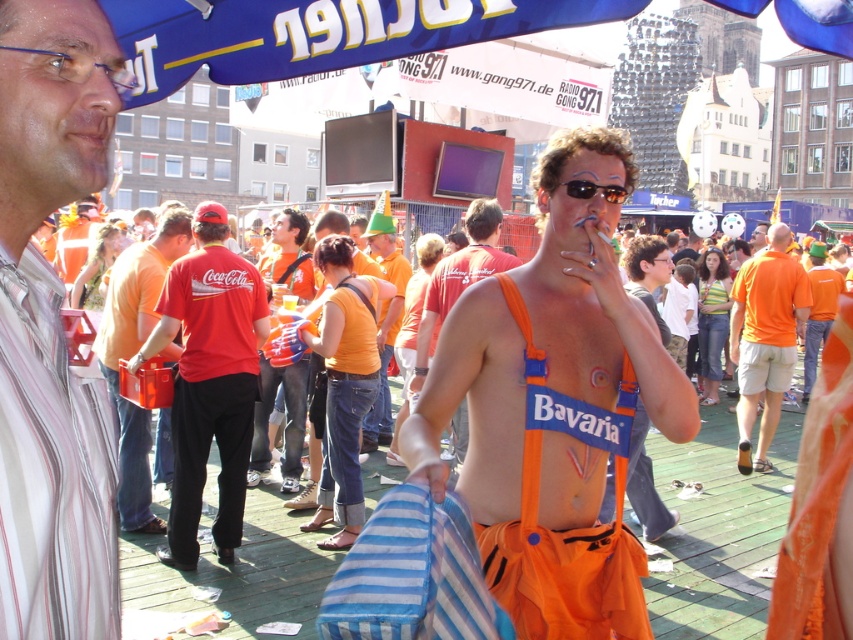
Which is behind, point (567, 228) or point (114, 97)?

Point (567, 228)

You are a GUI agent. You are given a task and a screenshot of the screen. Output one action in this format:
    pyautogui.click(x=<x>, y=<y>)
    Task: Click on the orange fabric at center
    Image resolution: width=853 pixels, height=640 pixels.
    Given the screenshot: What is the action you would take?
    pyautogui.click(x=555, y=404)

Is striped shirt at left positioned behind matte red t-shirt at center?

No, it is in front of matte red t-shirt at center.

Does point (21, 186) lie behind point (148, 330)?

No, it is in front of (148, 330).

Does point (22, 170) come farther from viewer compared to point (167, 212)?

That is False.

Locate an element on the screen. This screenshot has height=640, width=853. striped shirt at left is located at coordinates (51, 330).

Does point (61, 38) lie behind point (779, 275)?

No, (61, 38) is closer to viewer.

In order to click on striped shirt at left in this screenshot , I will do `click(51, 330)`.